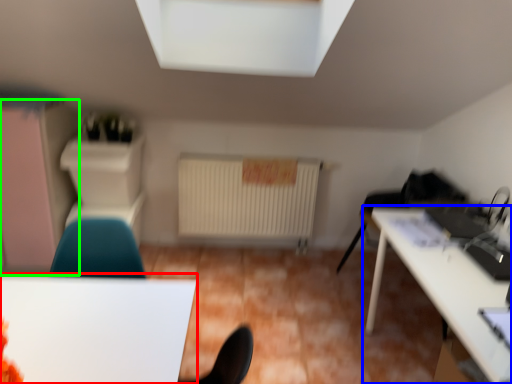
Question: Which object is the closest to the table (highlighted by a red box)? Choose among these: table (highlighted by a blue box) or dresser (highlighted by a green box).

Choices:
 (A) table
 (B) dresser

Answer: (A)